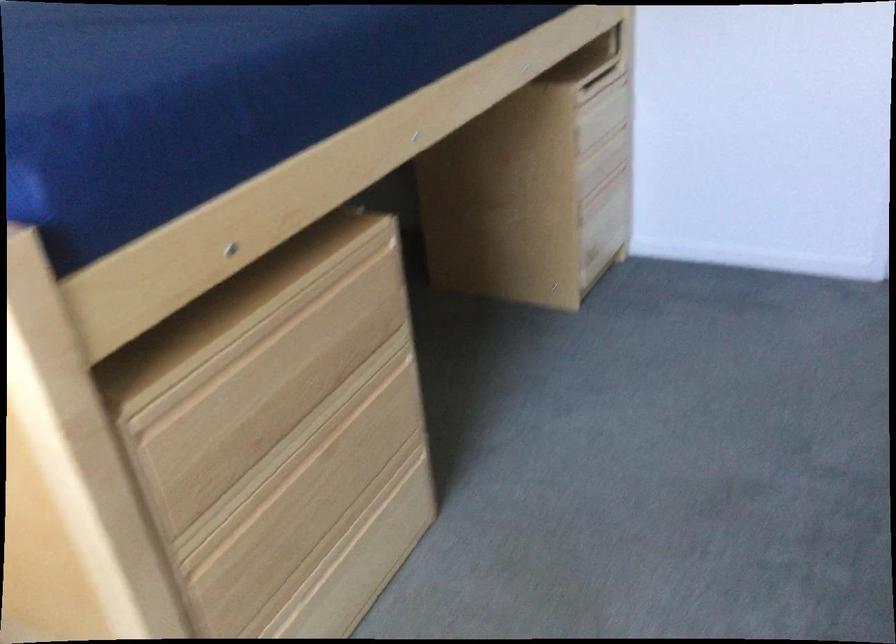
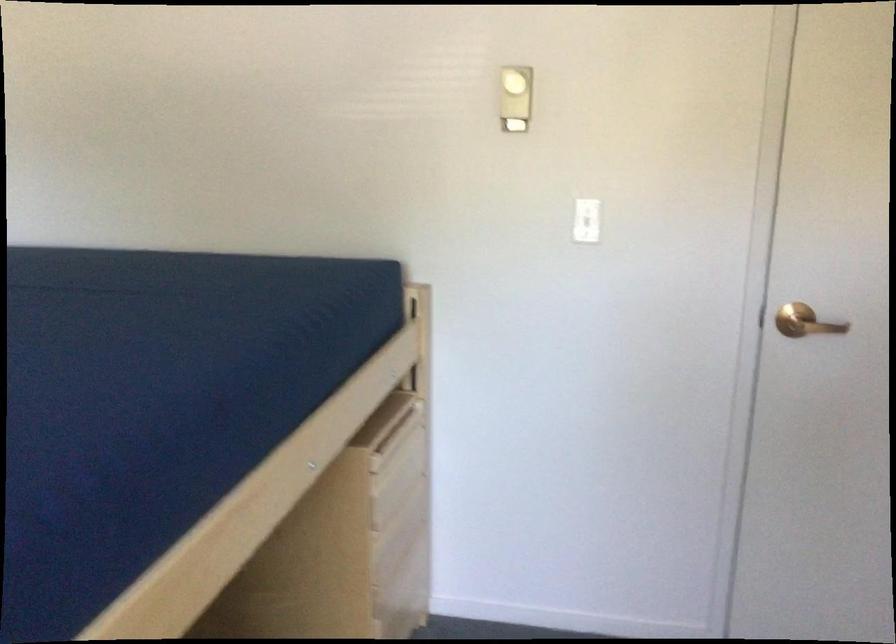
The first image is from the beginning of the video and the second image is from the end. How did the camera likely rotate when shooting the video?

The rotation direction of the camera is right-up.